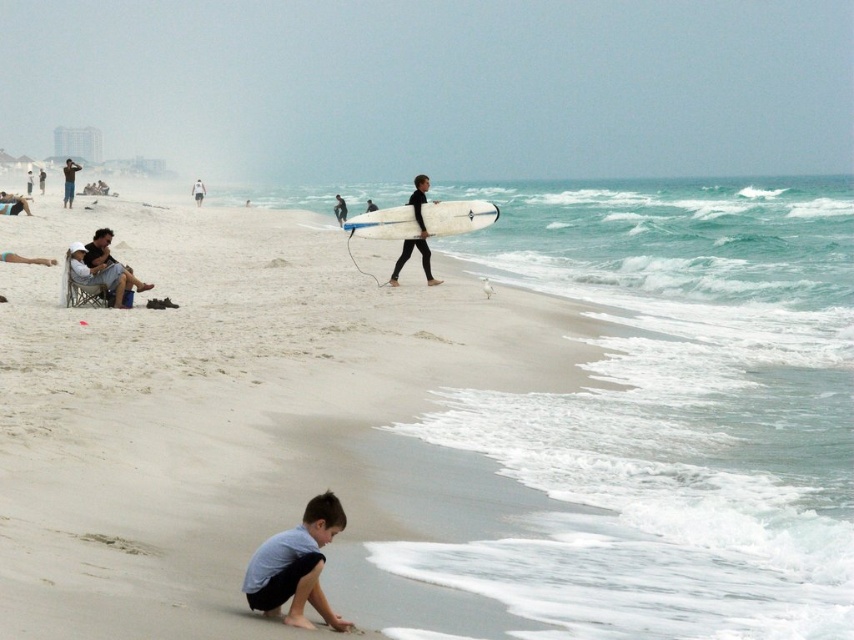
In the scene shown: Is white sand at center thinner than light brown fabric chair at upper left?

In fact, white sand at center might be wider than light brown fabric chair at upper left.

Which is behind, point (202, 291) or point (148, 284)?

Positioned behind is point (202, 291).

Locate an element on the screen. white sand at center is located at coordinates (232, 413).

How far apart are white sand at center and black wetsuit surfboard at center?

The distance of white sand at center from black wetsuit surfboard at center is 5.90 meters.

Locate an element on the screen. The image size is (854, 640). white sand at center is located at coordinates (232, 413).

Between white sand at center and white t-shirt at center, which one appears on the right side from the viewer's perspective?

From the viewer's perspective, white sand at center appears more on the right side.

Between point (206, 484) and point (196, 182), which one is positioned behind?

Point (196, 182)

The height and width of the screenshot is (640, 854). I want to click on white sand at center, so coord(232,413).

Where is `white sand at center`? The image size is (854, 640). white sand at center is located at coordinates (232, 413).